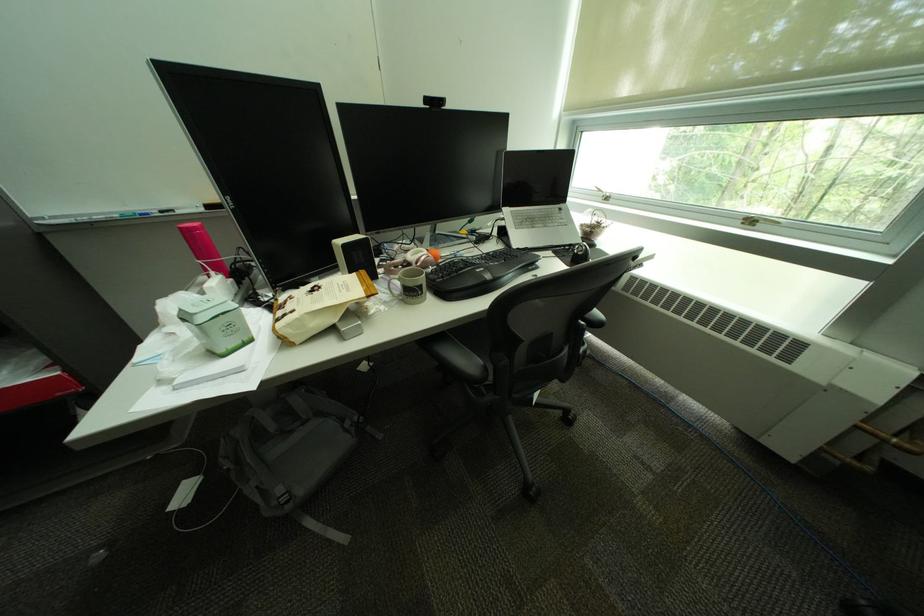
The location [538,198] corresponds to which object?

It refers to a silver laptop.